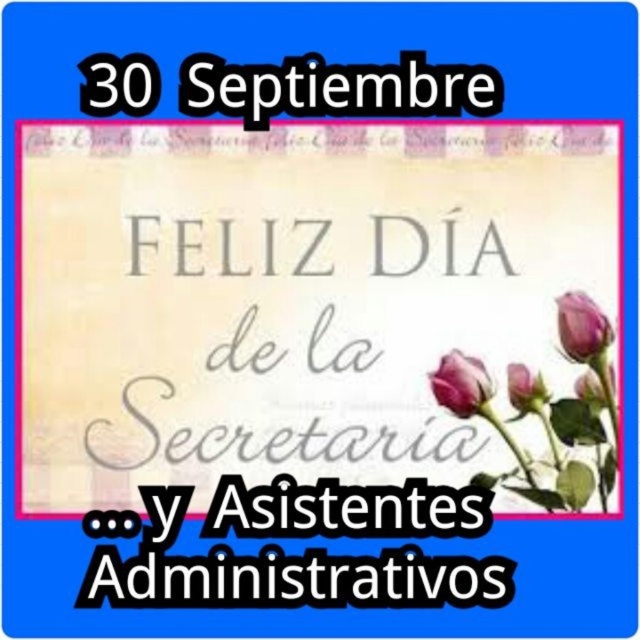
You are designing a floral arrangement for the secretary day card and see the pink matte rosebud at upper right and the purple matte rosebud at upper right. Which rosebud should you choose if you want the taller one for the top of the arrangement?

The pink matte rosebud at upper right is taller than the purple matte rosebud at upper right, so you should choose the pink matte rosebud at upper right for the top of the arrangement.

You are designing a digital card and need to arrange the pink matte rosebud at upper right and the purple matte rosebud at center. According to the image, which rosebud is positioned higher?

The pink matte rosebud at upper right is positioned higher than the purple matte rosebud at center.